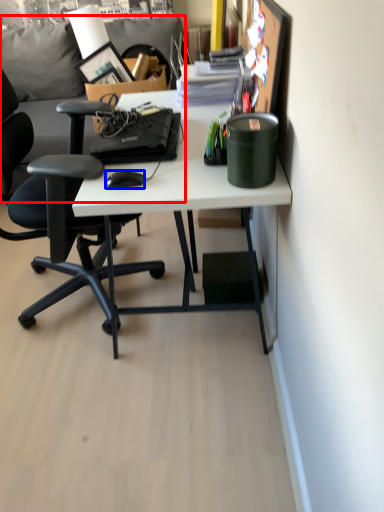
Question: Which of the following is the farthest to the observer, couch (highlighted by a red box) or mouse (highlighted by a blue box)?

Choices:
 (A) couch
 (B) mouse

Answer: (A)